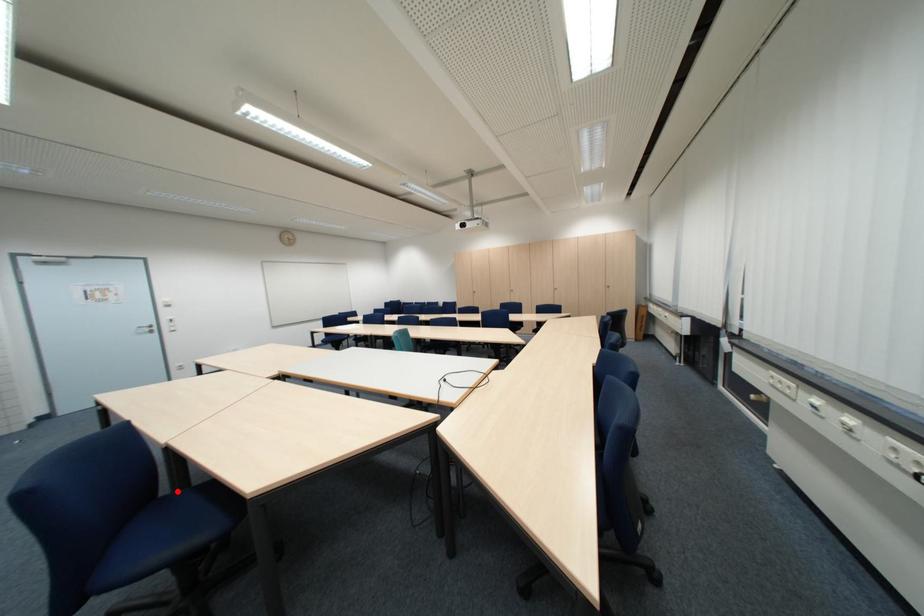
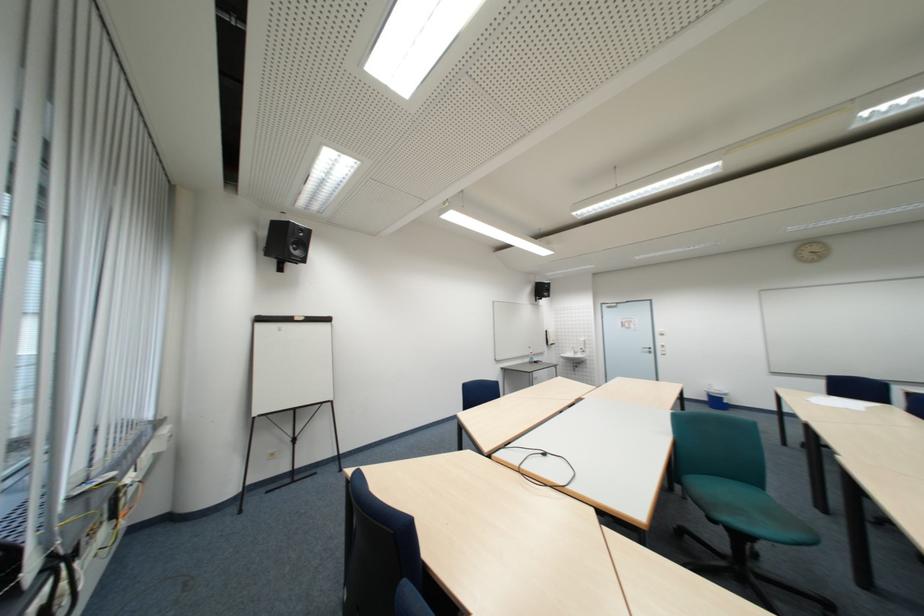
Question: I am providing you with two images of the same scene from different viewpoints. A red point is marked on the first image. Is the red point's position out of view in image 2?

Choices:
 (A) Yes
 (B) No

Answer: (A)